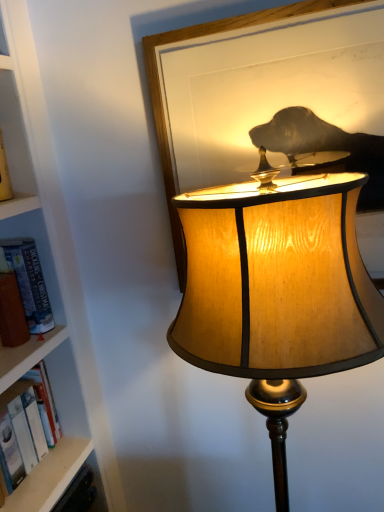
What do you see at coordinates (270, 98) in the screenshot? I see `wooden frame at upper center` at bounding box center [270, 98].

The image size is (384, 512). Describe the element at coordinates (276, 291) in the screenshot. I see `wooden lampshade at center` at that location.

The width and height of the screenshot is (384, 512). What are the coordinates of `wooden lampshade at center` in the screenshot? It's located at (276, 291).

The width and height of the screenshot is (384, 512). What do you see at coordinates (28, 282) in the screenshot?
I see `hardcover book at left` at bounding box center [28, 282].

In order to face hardcover book at left, should I rotate leftwards or rightwards?

To align with it, rotate left about 23.730°.

At what (x,y) coordinates should I click in order to perform the action: click on wooden frame at upper center. Please return your answer as a coordinate pair (x, y). The width and height of the screenshot is (384, 512). Looking at the image, I should click on (270, 98).

Based on their positions, is wooden lampshade at center located to the left or right of wooden frame at upper center?

Based on their positions, wooden lampshade at center is located to the right of wooden frame at upper center.

Could you tell me if wooden lampshade at center is facing wooden frame at upper center?

No, wooden lampshade at center is not oriented towards wooden frame at upper center.

Consider the image. Considering the relative sizes of wooden lampshade at center and wooden frame at upper center in the image provided, is wooden lampshade at center wider than wooden frame at upper center?

Correct, the width of wooden lampshade at center exceeds that of wooden frame at upper center.

Which is in front, point (293, 212) or point (337, 49)?

The point (293, 212) is more forward.

Considering the sizes of objects hardcover book at left and wooden frame at upper center in the image provided, who is taller, hardcover book at left or wooden frame at upper center?

wooden frame at upper center.

Is hardcover book at left spatially inside wooden frame at upper center, or outside of it?

hardcover book at left lies outside wooden frame at upper center.

Where is `picture frame above the hardcover book at left (from a real-world perspective)`? This screenshot has height=512, width=384. picture frame above the hardcover book at left (from a real-world perspective) is located at coordinates (270, 98).

Is hardcover book at left facing away from wooden frame at upper center?

No, wooden frame at upper center is not at the back of hardcover book at left.

From the picture: Is hardcover book at left placed right next to wooden lampshade at center?

hardcover book at left is not next to wooden lampshade at center, and they're not touching.

From the image's perspective, which one is positioned higher, hardcover book at left or wooden lampshade at center?

From the image's view, hardcover book at left is above.

Between hardcover book at left and wooden lampshade at center, which one has less height?

hardcover book at left.

Does wooden lampshade at center lie in front of hardcover book at left?

Yes.

From a real-world perspective, who is located higher, wooden lampshade at center or hardcover book at left?

hardcover book at left.

Visually, is wooden lampshade at center positioned to the left or to the right of hardcover book at left?

wooden lampshade at center is positioned on hardcover book at left's right side.

Looking at their sizes, would you say wooden lampshade at center is wider or thinner than hardcover book at left?

Considering their sizes, wooden lampshade at center looks broader than hardcover book at left.

Considering the positions of objects wooden frame at upper center and hardcover book at left in the image provided, who is behind, wooden frame at upper center or hardcover book at left?

hardcover book at left is further away from the camera.

Is the surface of wooden frame at upper center in direct contact with hardcover book at left?

They are not placed beside each other.

From a real-world perspective, is wooden frame at upper center positioned above or below hardcover book at left?

From a real-world perspective, wooden frame at upper center is physically above hardcover book at left.

Considering the relative sizes of wooden frame at upper center and hardcover book at left in the image provided, is wooden frame at upper center taller than hardcover book at left?

Correct, wooden frame at upper center is much taller as hardcover book at left.

From the image's perspective, which one is positioned lower, wooden frame at upper center or wooden lampshade at center?

From the image's view, wooden lampshade at center is below.

Does point (163, 82) come closer to viewer compared to point (322, 252)?

No, it is behind (322, 252).

Is wooden frame at upper center to the left of wooden lampshade at center from the viewer's perspective?

Yes, wooden frame at upper center is to the left of wooden lampshade at center.

In order to click on picture frame above the wooden lampshade at center (from a real-world perspective) in this screenshot , I will do `click(270, 98)`.

Where is `book behind the wooden frame at upper center`? The image size is (384, 512). book behind the wooden frame at upper center is located at coordinates (28, 282).

From the image, which object appears to be farther from hardcover book at left, wooden frame at upper center or wooden lampshade at center?

The object further to hardcover book at left is wooden lampshade at center.

Considering their positions, is wooden lampshade at center positioned closer to wooden frame at upper center than hardcover book at left?

wooden lampshade at center is positioned closer to the anchor wooden frame at upper center.

Estimate the real-world distances between objects in this image. Which object is further from wooden frame at upper center, hardcover book at left or wooden lampshade at center?

Based on the image, hardcover book at left appears to be further to wooden frame at upper center.

From the image, which object appears to be nearer to wooden lampshade at center, wooden frame at upper center or hardcover book at left?

wooden frame at upper center lies closer to wooden lampshade at center than the other object.

From the image, which object appears to be nearer to wooden lampshade at center, hardcover book at left or wooden frame at upper center?

wooden frame at upper center is positioned closer to the anchor wooden lampshade at center.

Considering their positions, is wooden lampshade at center positioned closer to hardcover book at left than wooden frame at upper center?

wooden frame at upper center.

Find the location of a particular element. The height and width of the screenshot is (512, 384). picture frame between hardcover book at left and wooden lampshade at center is located at coordinates (270, 98).